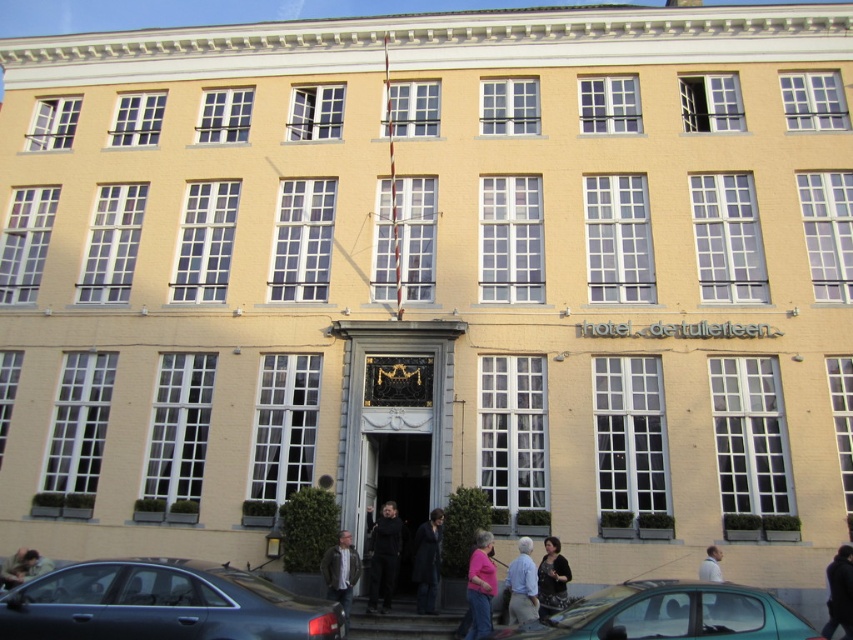
You are standing at the entrance of the three story building and want to park your matte black sedan at lower left. The parking spot is at point 0.945, 0.190. Is the parking spot available?

The position of matte black sedan at lower left is at point [161,604], which means the parking spot is occupied by the matte black sedan at lower left.

You are a delivery person arriving at the building and need to park your vehicle. The parking spot is marked by the pink fabric at lower center. Can your matte black sedan at lower left fit into the parking spot?

The matte black sedan at lower left is larger than the pink fabric at lower center, so it may not fit into the parking spot marked by the pink fabric at lower center. Consider finding a larger space.

You are standing in front of the building and notice a matte black sedan at lower left and a dark gray coat at center. Which object is positioned lower in the image?

The matte black sedan at lower left is positioned lower than the dark gray coat at center.